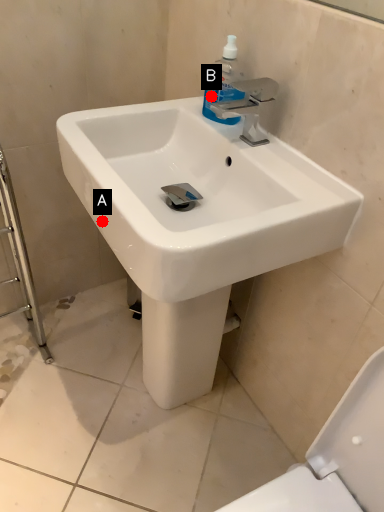
Question: Two points are circled on the image, labeled by A and B beside each circle. Which point is farther to the camera?

Choices:
 (A) A is further
 (B) B is further

Answer: (B)